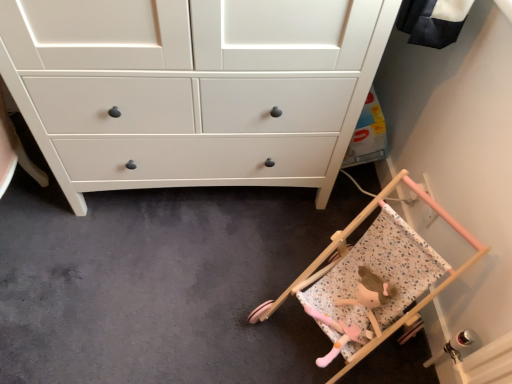
What do you see at coordinates (373, 274) in the screenshot? I see `wooden baby carriage at lower right` at bounding box center [373, 274].

Measure the distance between point (325,297) and camera.

The depth of point (325,297) is 1.24 meters.

Find the location of `wooden baby carriage at lower right`. wooden baby carriage at lower right is located at coordinates (373, 274).

What is the approximate width of fluffy pink doll at lower right?

The width of fluffy pink doll at lower right is 25.81 centimeters.

What do you see at coordinates (356, 314) in the screenshot? I see `fluffy pink doll at lower right` at bounding box center [356, 314].

Locate an element on the screen. Image resolution: width=512 pixels, height=384 pixels. fluffy pink doll at lower right is located at coordinates (356, 314).

In order to face fluffy pink doll at lower right, should I rotate leftwards or rightwards?

A 12.827 degree turn to the right will do.

Find the location of a particular element. This screenshot has width=512, height=384. wooden baby carriage at lower right is located at coordinates (373, 274).

From the picture: Considering the relative positions of fluffy pink doll at lower right and wooden baby carriage at lower right in the image provided, is fluffy pink doll at lower right to the right of wooden baby carriage at lower right from the viewer's perspective?

Indeed, fluffy pink doll at lower right is positioned on the right side of wooden baby carriage at lower right.

Considering the positions of objects fluffy pink doll at lower right and wooden baby carriage at lower right in the image provided, who is behind, fluffy pink doll at lower right or wooden baby carriage at lower right?

fluffy pink doll at lower right.

Does point (367, 333) lie behind point (346, 349)?

That is True.

From the image's perspective, who appears lower, fluffy pink doll at lower right or wooden baby carriage at lower right?

From the image's view, fluffy pink doll at lower right is below.

From a real-world perspective, between fluffy pink doll at lower right and wooden baby carriage at lower right, who is vertically higher?

wooden baby carriage at lower right is physically above.

Which object is wider, fluffy pink doll at lower right or wooden baby carriage at lower right?

With larger width is wooden baby carriage at lower right.

Between fluffy pink doll at lower right and wooden baby carriage at lower right, which one has more height?

wooden baby carriage at lower right is taller.

Considering the relative sizes of fluffy pink doll at lower right and wooden baby carriage at lower right in the image provided, is fluffy pink doll at lower right smaller than wooden baby carriage at lower right?

Correct, fluffy pink doll at lower right occupies less space than wooden baby carriage at lower right.

Is fluffy pink doll at lower right inside or outside of wooden baby carriage at lower right?

fluffy pink doll at lower right exists entirely within wooden baby carriage at lower right.

Is fluffy pink doll at lower right placed right next to wooden baby carriage at lower right?

Yes, fluffy pink doll at lower right and wooden baby carriage at lower right clearly make contact.

Is fluffy pink doll at lower right facing away from wooden baby carriage at lower right?

Absolutely, fluffy pink doll at lower right is directed away from wooden baby carriage at lower right.

The image size is (512, 384). In order to click on toy behind the wooden baby carriage at lower right in this screenshot , I will do `click(356, 314)`.

Can you confirm if wooden baby carriage at lower right is positioned to the right of fluffy pink doll at lower right?

Incorrect, wooden baby carriage at lower right is not on the right side of fluffy pink doll at lower right.

Who is more distant, wooden baby carriage at lower right or fluffy pink doll at lower right?

fluffy pink doll at lower right is further away from the camera.

Is point (409, 280) in front of point (333, 352)?

Yes, it is in front of point (333, 352).

From the image's perspective, would you say wooden baby carriage at lower right is shown under fluffy pink doll at lower right?

Actually, wooden baby carriage at lower right appears above fluffy pink doll at lower right in the image.

From a real-world perspective, is wooden baby carriage at lower right located higher than fluffy pink doll at lower right?

Yes.

Considering the relative sizes of wooden baby carriage at lower right and fluffy pink doll at lower right in the image provided, is wooden baby carriage at lower right thinner than fluffy pink doll at lower right?

No.

Is wooden baby carriage at lower right shorter than fluffy pink doll at lower right?

In fact, wooden baby carriage at lower right may be taller than fluffy pink doll at lower right.

Does wooden baby carriage at lower right have a smaller size compared to fluffy pink doll at lower right?

Incorrect, wooden baby carriage at lower right is not smaller in size than fluffy pink doll at lower right.

Which is correct: wooden baby carriage at lower right is inside fluffy pink doll at lower right, or outside of it?

wooden baby carriage at lower right is not inside fluffy pink doll at lower right, it's outside.

Is wooden baby carriage at lower right placed right next to fluffy pink doll at lower right?

Yes, wooden baby carriage at lower right and fluffy pink doll at lower right clearly make contact.

Looking at this image, is wooden baby carriage at lower right oriented towards fluffy pink doll at lower right?

Yes, wooden baby carriage at lower right is facing fluffy pink doll at lower right.

How many degrees apart are the facing directions of wooden baby carriage at lower right and fluffy pink doll at lower right?

wooden baby carriage at lower right and fluffy pink doll at lower right are facing 0.00159 degrees away from each other.

At what (x,y) coordinates should I click in order to perform the action: click on baby carriage positioned vertically above the fluffy pink doll at lower right (from a real-world perspective). Please return your answer as a coordinate pair (x, y). The width and height of the screenshot is (512, 384). Looking at the image, I should click on (373, 274).

I want to click on toy to the right of wooden baby carriage at lower right, so click(356, 314).

Locate an element on the screen. Image resolution: width=512 pixels, height=384 pixels. baby carriage in front of the fluffy pink doll at lower right is located at coordinates (373, 274).